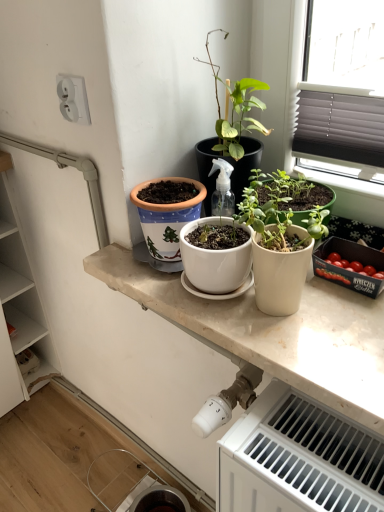
Identify the location of empty space that is ontop of white glossy countertop at center (from a real-world perspective). The width and height of the screenshot is (384, 512). (300, 302).